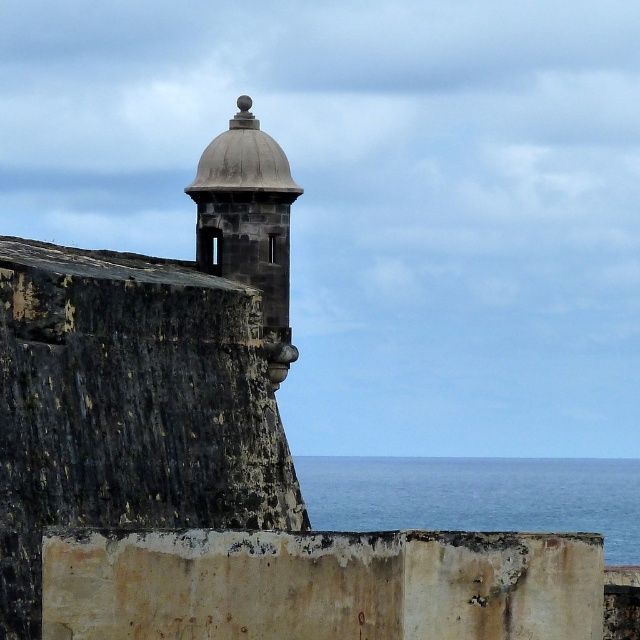
You are standing at the base of the historic fortification and want to determine which of the two points, point (625, 493) or point (250, 141), is closer to you. Based on the scene, which point is nearer?

Point (625, 493) is closer to you because it is further to the viewer than point (250, 141).